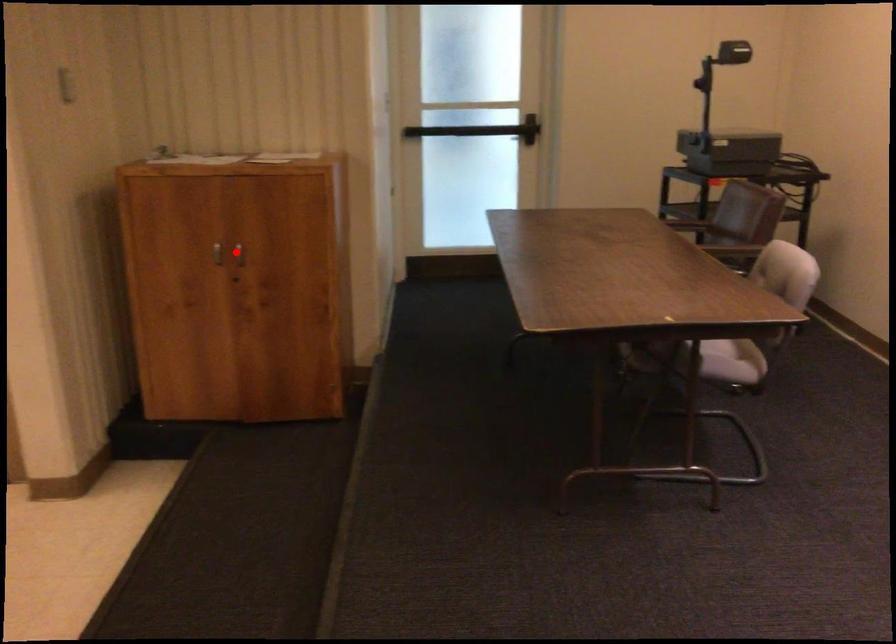
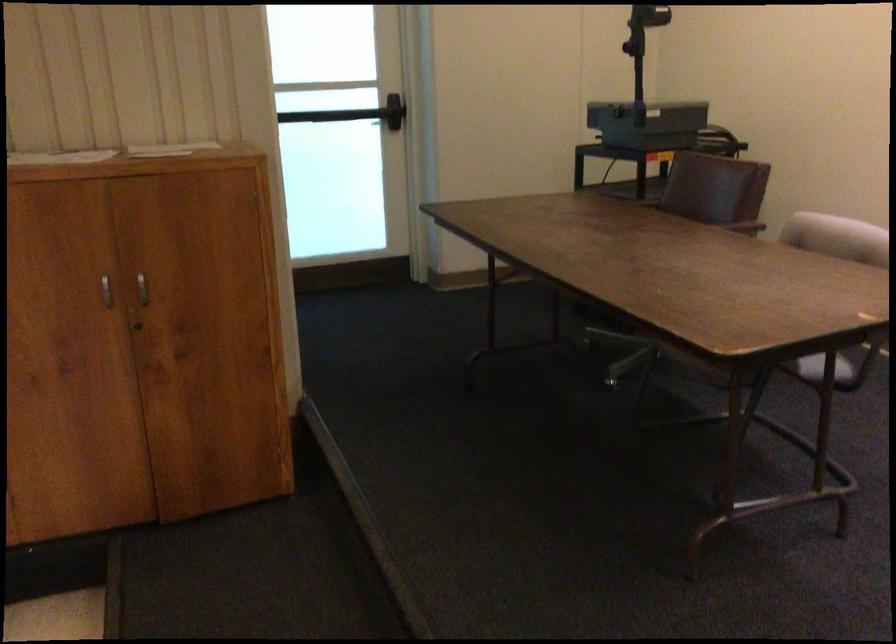
Locate, in the second image, the point that corresponds to the highlighted location in the first image.

(142, 289)